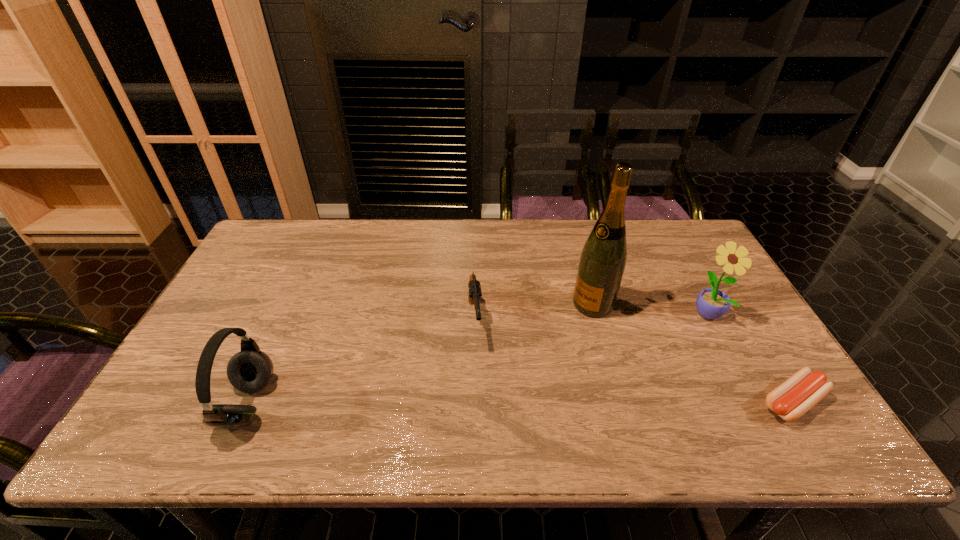
At what (x,y) coordinates should I click in order to perform the action: click on unoccupied area between the sunflower and the shortest object. Please return your answer as a coordinate pair (x, y). The width and height of the screenshot is (960, 540). Looking at the image, I should click on (750, 357).

Find the location of a particular element. This screenshot has height=540, width=960. free space between the sunflower and the sausage is located at coordinates (750, 357).

Find the location of a particular element. This screenshot has width=960, height=540. empty location between the leftmost object and the shortest object is located at coordinates (520, 403).

Find the location of a particular element. This screenshot has width=960, height=540. free space between the leftmost object and the fourth tallest object is located at coordinates (361, 362).

This screenshot has width=960, height=540. In order to click on unoccupied area between the leftmost object and the fourth tallest object in this screenshot , I will do `click(361, 362)`.

Locate an element on the screen. The image size is (960, 540). empty space between the tallest object and the sunflower is located at coordinates (650, 308).

You are a GUI agent. You are given a task and a screenshot of the screen. Output one action in this format:
    pyautogui.click(x=<x>, y=<y>)
    Task: Click on the vacant area between the shortest object and the third shortest object
    Image resolution: width=960 pixels, height=540 pixels.
    Given the screenshot: What is the action you would take?
    pyautogui.click(x=520, y=403)

Image resolution: width=960 pixels, height=540 pixels. Identify the location of vacant area that lies between the third object from left to right and the shortest object. (693, 353).

Find the location of a particular element. vacant area that lies between the shortest object and the sunflower is located at coordinates (750, 357).

This screenshot has width=960, height=540. I want to click on vacant space that is in between the wine bottle and the headset, so point(420,354).